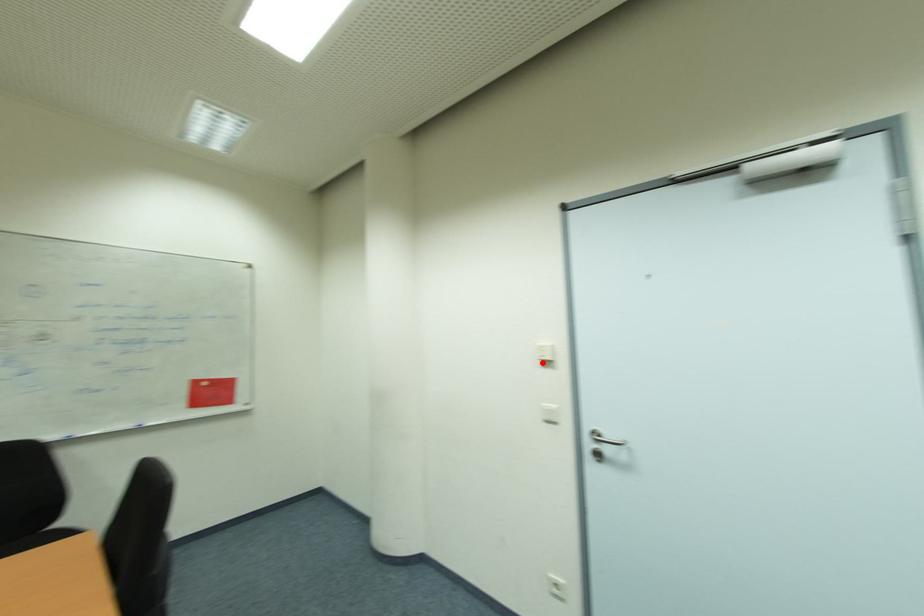
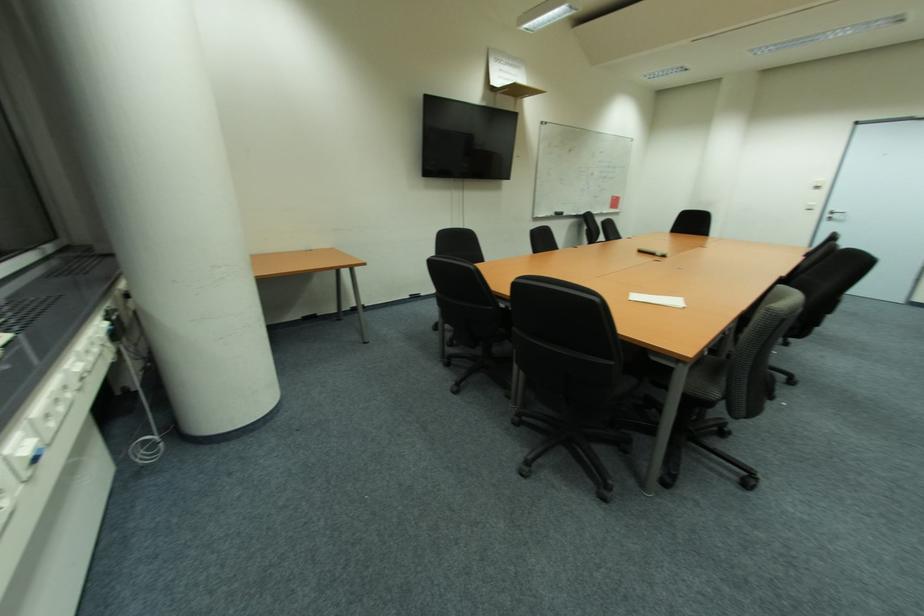
Question: I am providing you with two images of the same scene from different viewpoints. In image1, a red point is highlighted. Considering the same 3D point in image2, which of the following is correct?

Choices:
 (A) It is closer
 (B) It is farther

Answer: (B)